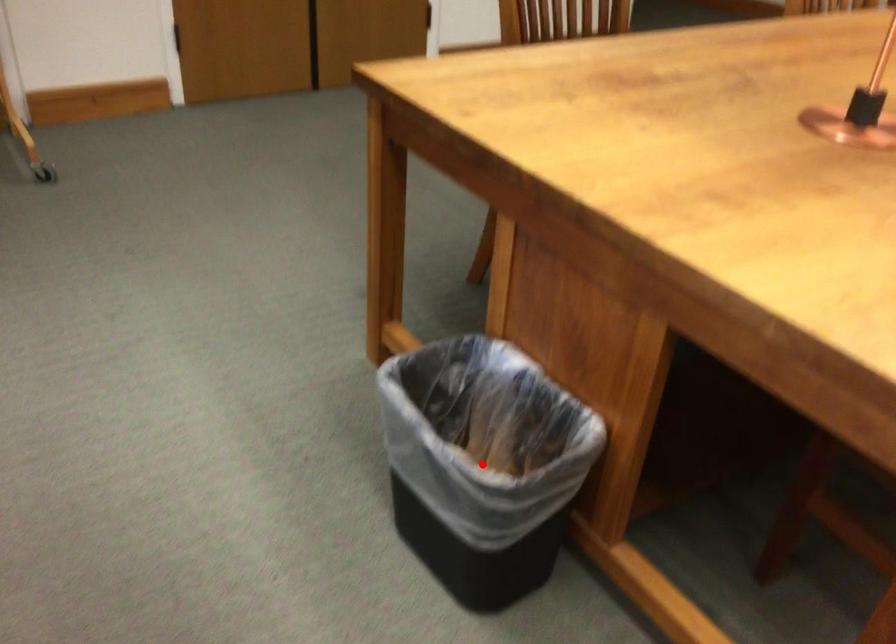
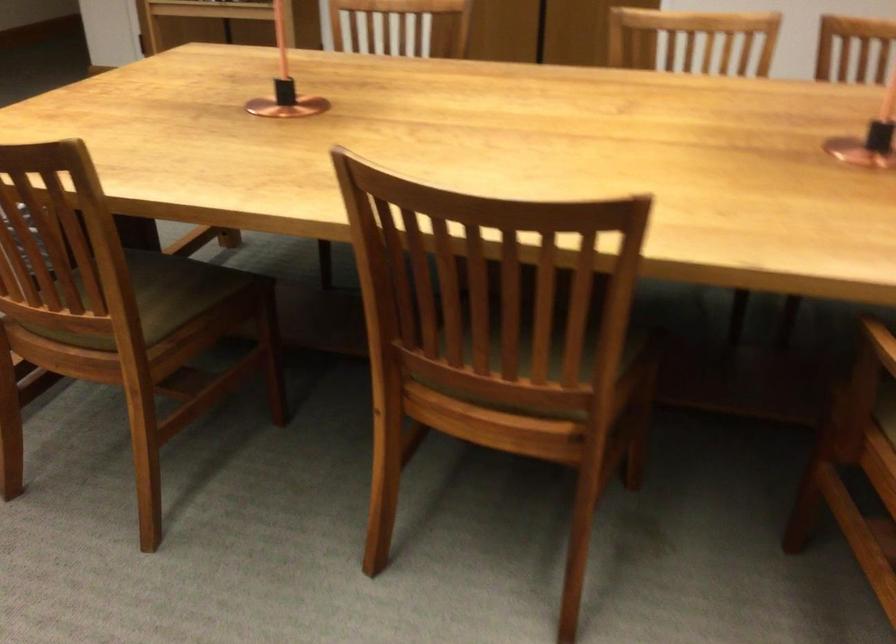
Question: I am providing you with two images of the same scene from different viewpoints. A red point is marked on the first image. At the location where the point appears in image 1, is it still visible in image 2?

Choices:
 (A) Yes
 (B) No

Answer: (B)